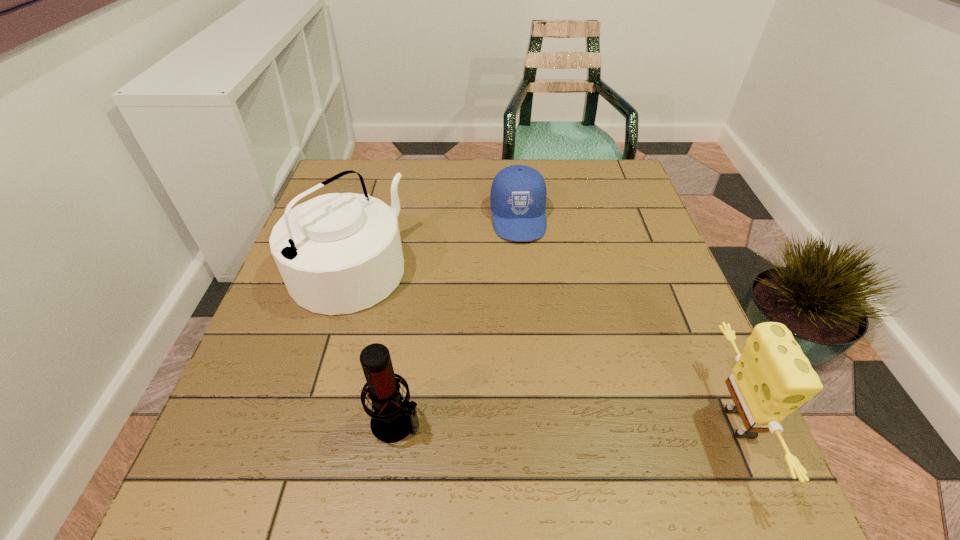
At what (x,y) coordinates should I click in order to perform the action: click on free spot on the desktop that is between the microphone and the sponge and is positioned on the spout of the kettle. Please return your answer as a coordinate pair (x, y). Image resolution: width=960 pixels, height=540 pixels. Looking at the image, I should click on (584, 422).

Where is `vacant space on the desktop that is between the microphone and the sponge and is positioned on the front-facing side of the cap`? This screenshot has height=540, width=960. vacant space on the desktop that is between the microphone and the sponge and is positioned on the front-facing side of the cap is located at coordinates (547, 422).